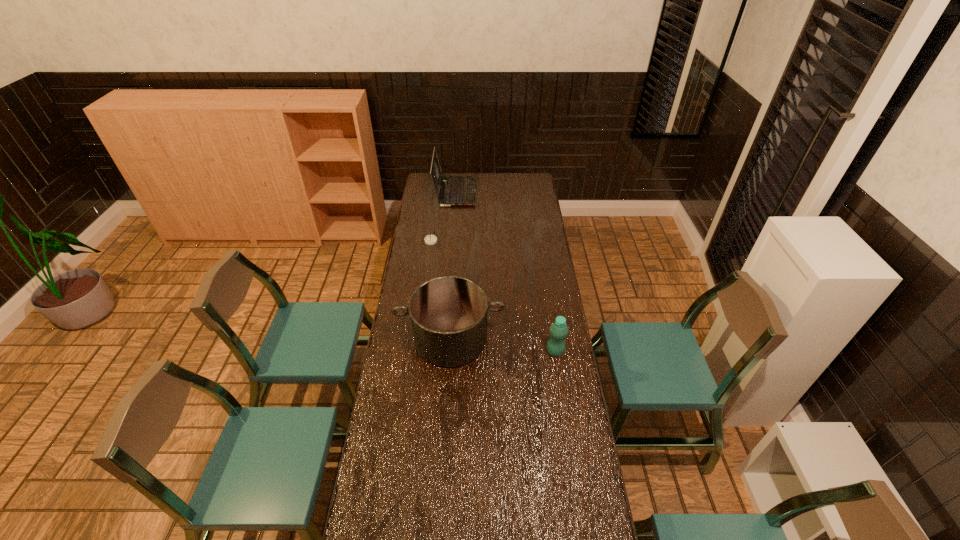
You are a GUI agent. You are given a task and a screenshot of the screen. Output one action in this format:
    pyautogui.click(x=<x>, y=<y>)
    Task: Click on the vacant area situated 0.350m on the right of the compass
    The image size is (960, 540).
    Given the screenshot: What is the action you would take?
    pyautogui.click(x=502, y=241)

Where is `object present at the far edge`? The width and height of the screenshot is (960, 540). object present at the far edge is located at coordinates (456, 190).

You are a GUI agent. You are given a task and a screenshot of the screen. Output one action in this format:
    pyautogui.click(x=<x>, y=<y>)
    Task: Click on the laptop computer positioned at the left edge
    
    Given the screenshot: What is the action you would take?
    pyautogui.click(x=456, y=190)

Locate an element on the screen. pan at the left edge is located at coordinates (448, 314).

Find the location of a particular element. The height and width of the screenshot is (540, 960). compass that is at the left edge is located at coordinates (430, 239).

Locate an element on the screen. Image resolution: width=960 pixels, height=540 pixels. object at the right edge is located at coordinates (559, 330).

You are a GUI agent. You are given a task and a screenshot of the screen. Output one action in this format:
    pyautogui.click(x=<x>, y=<y>)
    Task: Click on the object at the far left corner
    The image size is (960, 540).
    Given the screenshot: What is the action you would take?
    pyautogui.click(x=456, y=190)

This screenshot has width=960, height=540. What are the coordinates of `vacant region at the far edge` in the screenshot? It's located at (507, 179).

Where is `blank space at the left edge of the desktop`? The width and height of the screenshot is (960, 540). blank space at the left edge of the desktop is located at coordinates (413, 267).

Locate an element on the screen. free space at the right edge of the desktop is located at coordinates (535, 310).